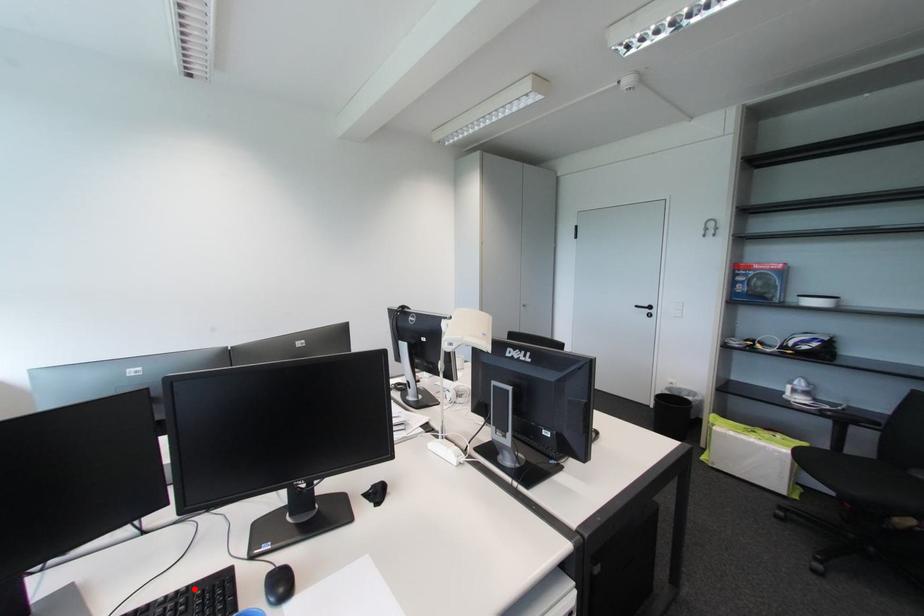
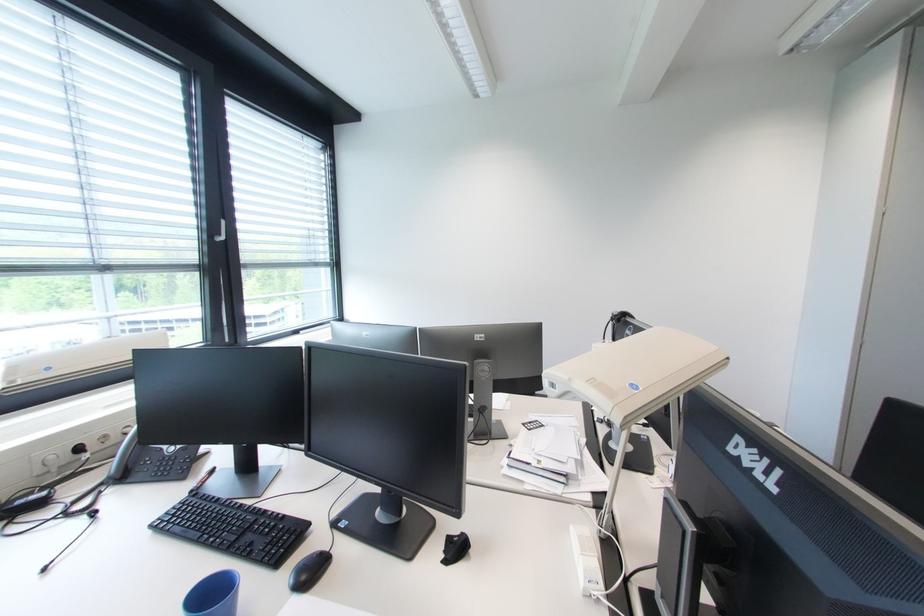
In the second image, find the point that corresponds to the highlighted location in the first image.

(290, 517)